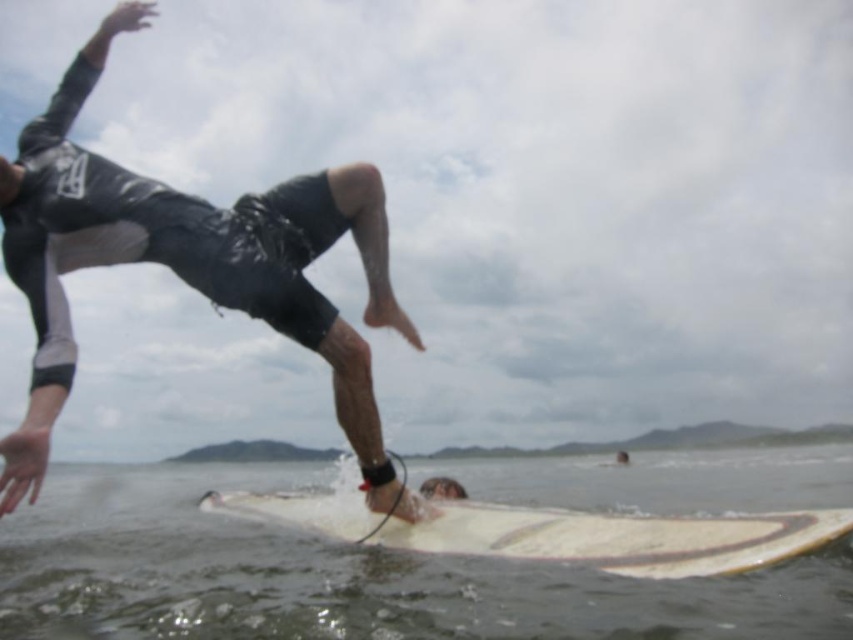
Who is positioned more to the right, gray wetsuit surfer at left or white smooth surfboard at lower center?

white smooth surfboard at lower center is more to the right.

Does gray wetsuit surfer at left appear over white smooth surfboard at lower center?

Yes.

The width and height of the screenshot is (853, 640). Identify the location of gray wetsuit surfer at left. (189, 262).

Between white smooth surfboard at center and gray wetsuit surfer at left, which one appears on the right side from the viewer's perspective?

From the viewer's perspective, gray wetsuit surfer at left appears more on the right side.

Can you confirm if white smooth surfboard at center is taller than gray wetsuit surfer at left?

Incorrect, white smooth surfboard at center's height is not larger of gray wetsuit surfer at left's.

You are a GUI agent. You are given a task and a screenshot of the screen. Output one action in this format:
    pyautogui.click(x=<x>, y=<y>)
    Task: Click on the white smooth surfboard at center
    The height and width of the screenshot is (640, 853).
    Given the screenshot: What is the action you would take?
    pyautogui.click(x=344, y=573)

Find the location of a particular element. The width and height of the screenshot is (853, 640). white smooth surfboard at center is located at coordinates (344, 573).

Which of these two, white smooth surfboard at center or white smooth surfboard at lower center, stands shorter?

With less height is white smooth surfboard at lower center.

Does white smooth surfboard at center lie in front of white smooth surfboard at lower center?

No, white smooth surfboard at center is further to the viewer.

Who is more forward, (422,611) or (341,518)?

Point (422,611)

What are the coordinates of `white smooth surfboard at center` in the screenshot? It's located at (344, 573).